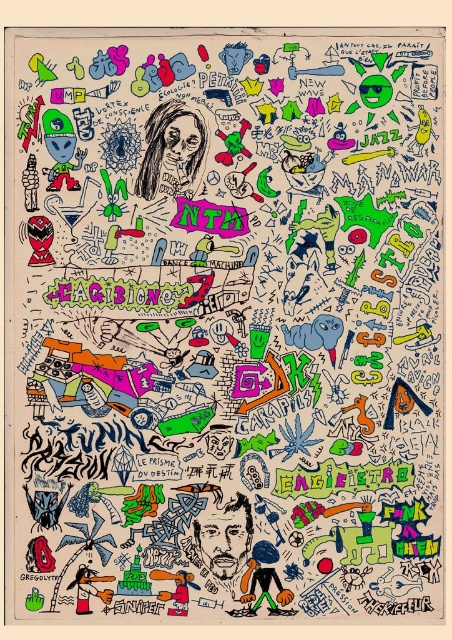
You are standing in front of the artwork and want to know how far the point at coordinates (180, 100) is from your eyes. Can you determine the distance?

The distance of point (180, 100) from camera is 3.68 feet, so the point is approximately 3.68 feet away from your eyes.

You are an art student analyzing this chaotic artwork. You notice the charcoal sketch of person at upper left and the shaggy hair at center. Which object is positioned higher in the image?

The charcoal sketch of person at upper left is positioned higher in the image than the shaggy hair at center.

You are an artist standing in front of this vibrant and chaotic illustration. You need to locate the charcoal sketch of person at upper left. Where exactly is it located on the image?

The charcoal sketch of person at upper left is located at point (173, 150).